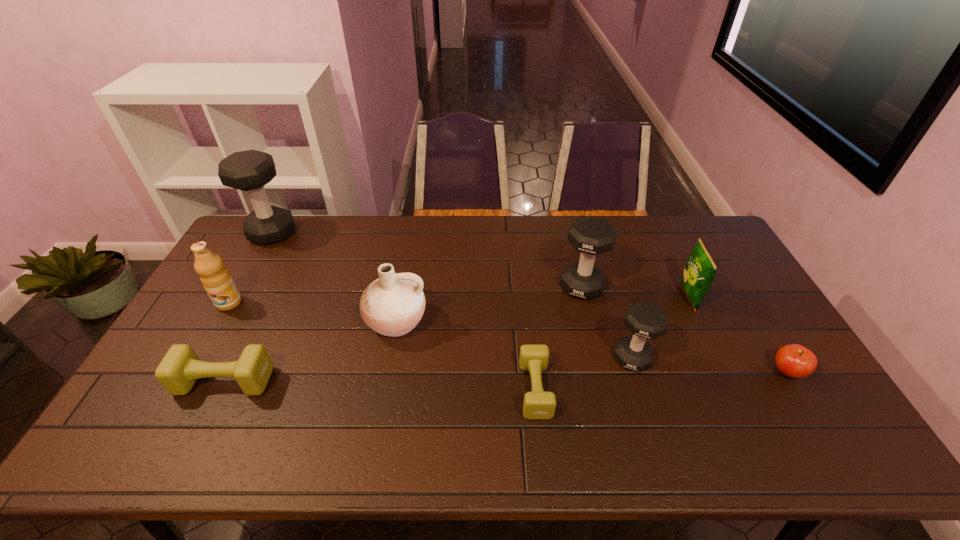
Image resolution: width=960 pixels, height=540 pixels. In order to click on vacant point located between the pottery and the farthest gray dumbbell in this screenshot , I will do `click(334, 276)`.

Identify the location of vacant space that is in between the sixth object from right to left and the olive oil. The image size is (960, 540). (313, 312).

The height and width of the screenshot is (540, 960). In order to click on free spot between the smaller olive dumbbell and the left olive dumbbell in this screenshot , I will do pyautogui.click(x=380, y=385).

Locate an element on the screen. free space between the olive oil and the smaller olive dumbbell is located at coordinates (382, 346).

This screenshot has height=540, width=960. I want to click on free space between the olive oil and the second shortest dumbbell, so click(227, 342).

Locate an element on the screen. The width and height of the screenshot is (960, 540). empty space that is in between the leftmost gray dumbbell and the second tallest dumbbell is located at coordinates (427, 260).

The height and width of the screenshot is (540, 960). Identify the location of object that is the seventh closest to the leftmost gray dumbbell. (700, 271).

Find the location of `the fifth closest object relative to the apple`. the fifth closest object relative to the apple is located at coordinates (392, 305).

Locate which dumbbell is the closest to the crisp (potato chip). Please provide its 2D coordinates. Your answer should be formatted as a tuple, i.e. [(x, y)], where the tuple contains the x and y coordinates of a point satisfying the conditions above.

[(645, 320)]

I want to click on dumbbell that is the third nearest to the farthest object, so click(590, 235).